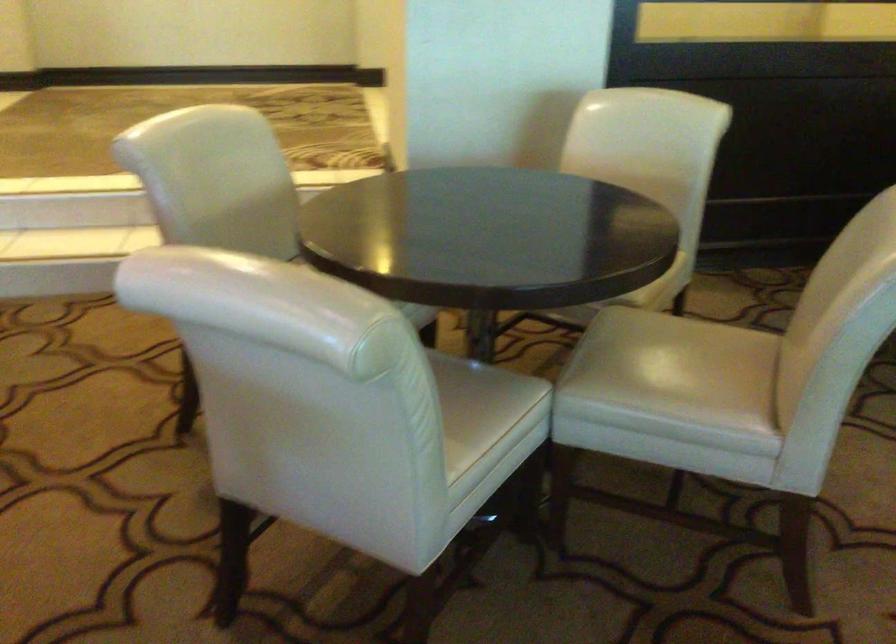
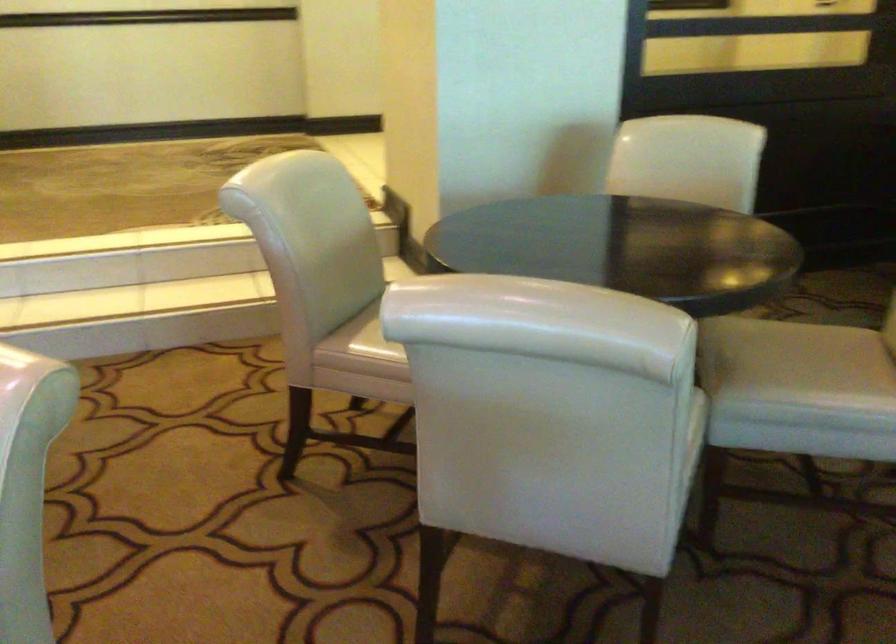
Question: Which direction would the cameraman need to move to produce the second image? Reply with the corresponding letter.

Choices:
 (A) Left
 (B) Right
 (C) Forward
 (D) Backward

Answer: (A)